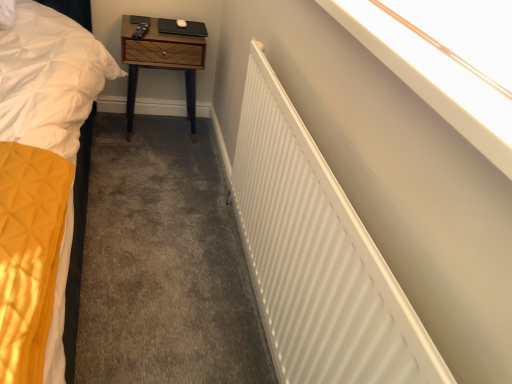
Question: In terms of size, does woodenmaterial/texturenightstand at upper center appear bigger or smaller than white matte radiator at upper right?

Choices:
 (A) big
 (B) small

Answer: (B)

Question: In terms of height, does woodenmaterial/texturenightstand at upper center look taller or shorter compared to white matte radiator at upper right?

Choices:
 (A) tall
 (B) short

Answer: (B)

Question: Based on their relative distances, which object is nearer to the white matte radiator at upper right?

Choices:
 (A) white smooth wall at upper right
 (B) woodenmaterial/texturenightstand at upper center

Answer: (A)

Question: Estimate the real-world distances between objects in this image. Which object is farther from the woodenmaterial/texturenightstand at upper center?

Choices:
 (A) white matte radiator at upper right
 (B) white smooth wall at upper right

Answer: (B)